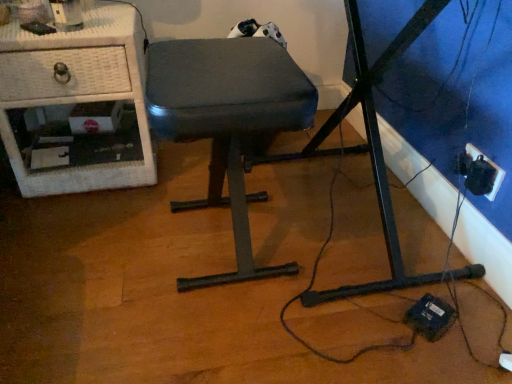
The height and width of the screenshot is (384, 512). Identify the location of vacant area that lies in front of white wicker nightstand at left. (76, 232).